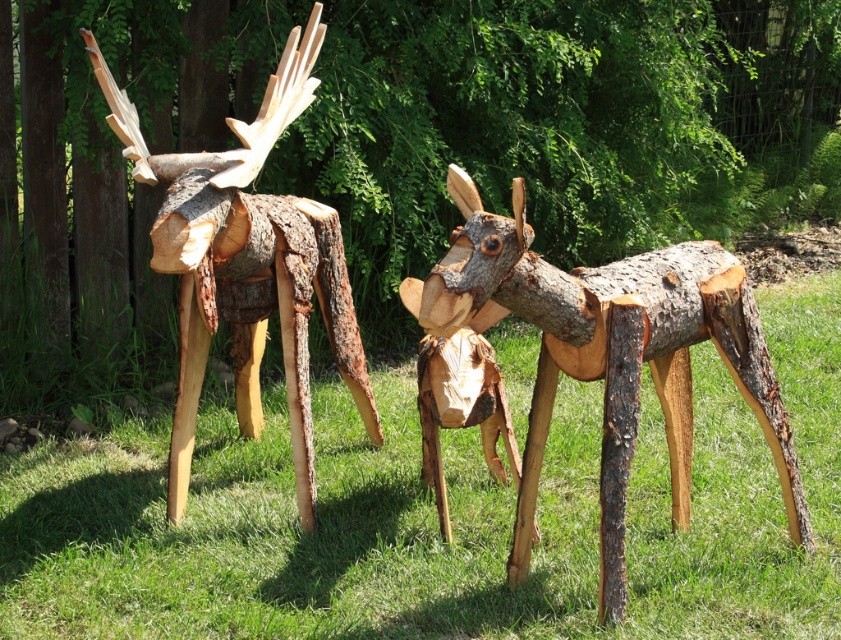
Question: Is the position of green grass at center more distant than that of natural wood moose at left?

Choices:
 (A) no
 (B) yes

Answer: (B)

Question: Which object is positioned farthest from the natural wood moose at center?

Choices:
 (A) green grass at center
 (B) natural wood moose at left

Answer: (B)

Question: Which point is farther to the camera?

Choices:
 (A) natural wood moose at left
 (B) green grass at center
 (C) natural wood moose at center

Answer: (B)

Question: Can you confirm if green grass at center is thinner than natural wood moose at center?

Choices:
 (A) yes
 (B) no

Answer: (B)

Question: Which point is farther from the camera taking this photo?

Choices:
 (A) (678, 296)
 (B) (108, 435)
 (C) (86, 38)

Answer: (B)

Question: Is green grass at center positioned before natural wood moose at left?

Choices:
 (A) no
 (B) yes

Answer: (A)